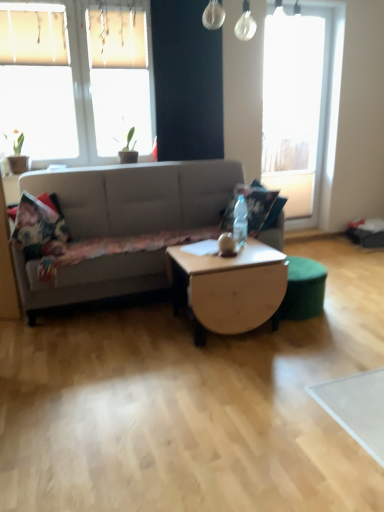
What do you see at coordinates (76, 80) in the screenshot?
I see `white fabric window at upper left, marked as the second window in a back-to-front arrangement` at bounding box center [76, 80].

At what (x,y) coordinates should I click in order to perform the action: click on fluffy floral pillow at center, the 2th pillow from the left. Please return your answer as a coordinate pair (x, y). This screenshot has height=512, width=384. Looking at the image, I should click on (254, 207).

This screenshot has width=384, height=512. What do you see at coordinates (139, 196) in the screenshot?
I see `matte gray studio couch at center` at bounding box center [139, 196].

This screenshot has height=512, width=384. What are the coordinates of `green matte plant at upper left` in the screenshot? It's located at 18,154.

Is wooden coffee table at center inside translucent glass bottle at center?

Actually, wooden coffee table at center is outside translucent glass bottle at center.

Can you tell me how much translucent glass bottle at center and wooden coffee table at center differ in facing direction?

translucent glass bottle at center and wooden coffee table at center are facing 0.00136 degrees away from each other.

From a real-world perspective, which object stands above the other?

translucent glass bottle at center.

Measure the distance from translucent glass bottle at center to wooden coffee table at center.

The distance of translucent glass bottle at center from wooden coffee table at center is 15.61 inches.

From a real-world perspective, between green matte plant at upper left and translucent glass bottle at center, who is vertically higher?

From a 3D spatial view, green matte plant at upper left is above.

From the image's perspective, is green matte plant at upper left beneath translucent glass bottle at center?

No, from the image's perspective, green matte plant at upper left is not below translucent glass bottle at center.

Is green matte plant at upper left spatially inside translucent glass bottle at center, or outside of it?

The correct answer is: outside.

Can you confirm if green matte plant at upper left is positioned to the left of fluffy floral pillow at left, the 2th pillow from the right?

Correct, you'll find green matte plant at upper left to the left of fluffy floral pillow at left, the 2th pillow from the right.

Locate an element on the screen. The height and width of the screenshot is (512, 384). the 2nd pillow in front of the green matte plant at upper left, counting from the anchor's position is located at coordinates (37, 224).

Can we say green matte plant at upper left lies outside fluffy floral pillow at left, the 2th pillow from the right?

Yes, green matte plant at upper left is located beyond the bounds of fluffy floral pillow at left, the 2th pillow from the right.

From a real-world perspective, is green matte plant at upper left positioned over fluffy floral pillow at left, the 2th pillow from the right, based on gravity?

Indeed, from a real-world perspective, green matte plant at upper left stands above fluffy floral pillow at left, the 2th pillow from the right.

Does fluffy floral pillow at center, which ranks as the 1th pillow in right-to-left order, turn towards fluffy floral pillow at left, which is the first pillow in left-to-right order?

Yes, fluffy floral pillow at center, which ranks as the 1th pillow in right-to-left order, is aimed at fluffy floral pillow at left, which is the first pillow in left-to-right order.

From a real-world perspective, is fluffy floral pillow at center, which ranks as the 1th pillow in right-to-left order, positioned over fluffy floral pillow at left, which is the first pillow in left-to-right order, based on gravity?

No, from a real-world perspective, fluffy floral pillow at center, which ranks as the 1th pillow in right-to-left order, is not on top of fluffy floral pillow at left, which is the first pillow in left-to-right order.

Are fluffy floral pillow at center, the 2th pillow from the left, and fluffy floral pillow at left, the 2th pillow from the right, far apart?

That's right, there is a large distance between fluffy floral pillow at center, the 2th pillow from the left, and fluffy floral pillow at left, the 2th pillow from the right.

Could you measure the distance between matte gray studio couch at center and white fabric window at upper left, marked as the second window in a back-to-front arrangement?

matte gray studio couch at center is 34.21 inches from white fabric window at upper left, marked as the second window in a back-to-front arrangement.

Does matte gray studio couch at center have a larger size compared to white fabric window at upper left, which ranks as the first window in front-to-back order?

Indeed, matte gray studio couch at center has a larger size compared to white fabric window at upper left, which ranks as the first window in front-to-back order.

Which point is more distant from viewer, (221, 190) or (148, 96)?

Point (148, 96)

Considering the relative sizes of fluffy floral pillow at center, which ranks as the 1th pillow in right-to-left order, and white fabric window at upper left, acting as the 2th window starting from the right, in the image provided, is fluffy floral pillow at center, which ranks as the 1th pillow in right-to-left order, bigger than white fabric window at upper left, acting as the 2th window starting from the right,?

Actually, fluffy floral pillow at center, which ranks as the 1th pillow in right-to-left order, might be smaller than white fabric window at upper left, acting as the 2th window starting from the right.

Which is in front, fluffy floral pillow at center, which ranks as the 1th pillow in right-to-left order, or white fabric window at upper left, marked as the second window in a back-to-front arrangement?

fluffy floral pillow at center, which ranks as the 1th pillow in right-to-left order, is closer to the camera.

From the image's perspective, is fluffy floral pillow at center, which ranks as the 1th pillow in right-to-left order, located above or below white fabric window at upper left, which is the first window from left to right?

Clearly, from the image's perspective, fluffy floral pillow at center, which ranks as the 1th pillow in right-to-left order, is below white fabric window at upper left, which is the first window from left to right.

Looking at this image, is fluffy floral pillow at center, which ranks as the 1th pillow in right-to-left order, to the left of white fabric window at upper left, which is the first window from left to right, from the viewer's perspective?

No.

Is wooden coffee table at center in front of transparent glass window at upper right, which is the second window from front to back?

Yes, wooden coffee table at center is closer to the camera.

Between wooden coffee table at center and transparent glass window at upper right, which is the second window from front to back, which one appears on the right side from the viewer's perspective?

transparent glass window at upper right, which is the second window from front to back.

From the image's perspective, which is above, wooden coffee table at center or transparent glass window at upper right, which is the 1th window in back-to-front order?

transparent glass window at upper right, which is the 1th window in back-to-front order, appears higher in the image.

Can transparent glass window at upper right, which is the 1th window in back-to-front order, be found inside wooden coffee table at center?

No, wooden coffee table at center does not contain transparent glass window at upper right, which is the 1th window in back-to-front order.

At what (x,y) coordinates should I click in order to perform the action: click on bottle above the wooden coffee table at center (from the image's perspective). Please return your answer as a coordinate pair (x, y). The image size is (384, 512). Looking at the image, I should click on (240, 223).

Identify the location of bottle below the green matte plant at upper left (from the image's perspective). (240, 223).

Looking at the image, which one is located closer to matte gray studio couch at center, wooden coffee table at center or transparent glass window at upper right, which ranks as the second window in left-to-right order?

wooden coffee table at center is closer to matte gray studio couch at center.

Which object lies further to the anchor point wooden coffee table at center, transparent glass window at upper right, which is the second window from front to back, or fluffy floral pillow at center, the 2th pillow from the left?

transparent glass window at upper right, which is the second window from front to back, is further to wooden coffee table at center.

Estimate the real-world distances between objects in this image. Which object is further from matte gray studio couch at center, green matte plant at upper left or translucent glass bottle at center?

The object further to matte gray studio couch at center is green matte plant at upper left.

When comparing their distances from fluffy floral pillow at left, which is the first pillow in left-to-right order, does transparent glass window at upper right, which is the second window from front to back, or green matte plant at upper left seem further?

transparent glass window at upper right, which is the second window from front to back, is positioned further to the anchor fluffy floral pillow at left, which is the first pillow in left-to-right order.

Considering their positions, is fluffy floral pillow at center, the 2th pillow from the left, positioned closer to wooden coffee table at center than matte gray studio couch at center?

fluffy floral pillow at center, the 2th pillow from the left, is closer to wooden coffee table at center.

Which object lies further to the anchor point translucent glass bottle at center, matte gray studio couch at center or green matte plant at upper left?

The object further to translucent glass bottle at center is green matte plant at upper left.

When comparing their distances from transparent glass window at upper right, which is the second window from front to back, does wooden coffee table at center or translucent glass bottle at center seem closer?

Among the two, translucent glass bottle at center is located nearer to transparent glass window at upper right, which is the second window from front to back.

Based on their spatial positions, is matte gray studio couch at center or green matte plant at upper left further from wooden coffee table at center?

green matte plant at upper left is further to wooden coffee table at center.

At what (x,y) coordinates should I click in order to perform the action: click on bottle that lies between white fabric window at upper left, acting as the 2th window starting from the right, and wooden coffee table at center from top to bottom. Please return your answer as a coordinate pair (x, y). Looking at the image, I should click on click(240, 223).

Where is `bottle between fluffy floral pillow at left, which is the first pillow in left-to-right order, and transparent glass window at upper right, which ranks as the second window in left-to-right order, in the horizontal direction`? This screenshot has width=384, height=512. bottle between fluffy floral pillow at left, which is the first pillow in left-to-right order, and transparent glass window at upper right, which ranks as the second window in left-to-right order, in the horizontal direction is located at coordinates (240, 223).

Identify the location of studio couch between fluffy floral pillow at left, which is the first pillow in left-to-right order, and fluffy floral pillow at center, which ranks as the 1th pillow in right-to-left order. The width and height of the screenshot is (384, 512). (139, 196).

At what (x,y) coordinates should I click in order to perform the action: click on pillow located between green matte plant at upper left and fluffy floral pillow at center, the 2th pillow from the left, in the left-right direction. Please return your answer as a coordinate pair (x, y). Looking at the image, I should click on (37, 224).